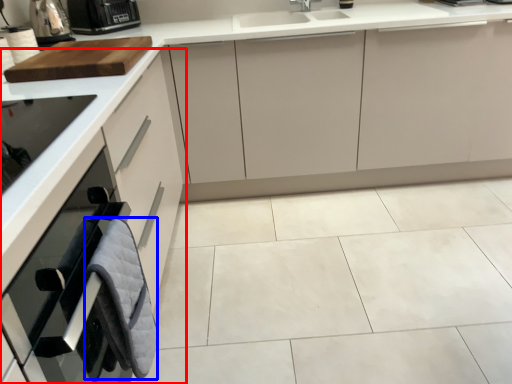
Question: Which of the following is the closest to the observer, cabinetry (highlighted by a red box) or material (highlighted by a blue box)?

Choices:
 (A) cabinetry
 (B) material

Answer: (A)